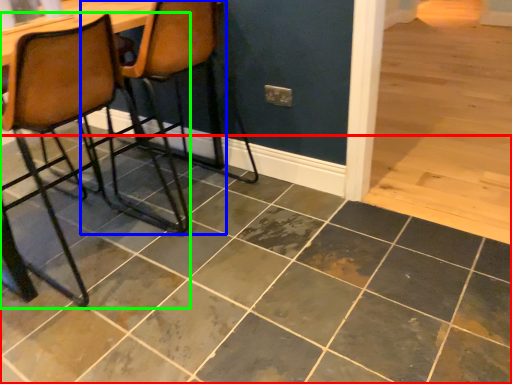
Question: Based on their relative distances, which object is nearer to ceramic tile (highlighted by a red box)? Choose from chair (highlighted by a blue box) and chair (highlighted by a green box).

Choices:
 (A) chair
 (B) chair

Answer: (B)